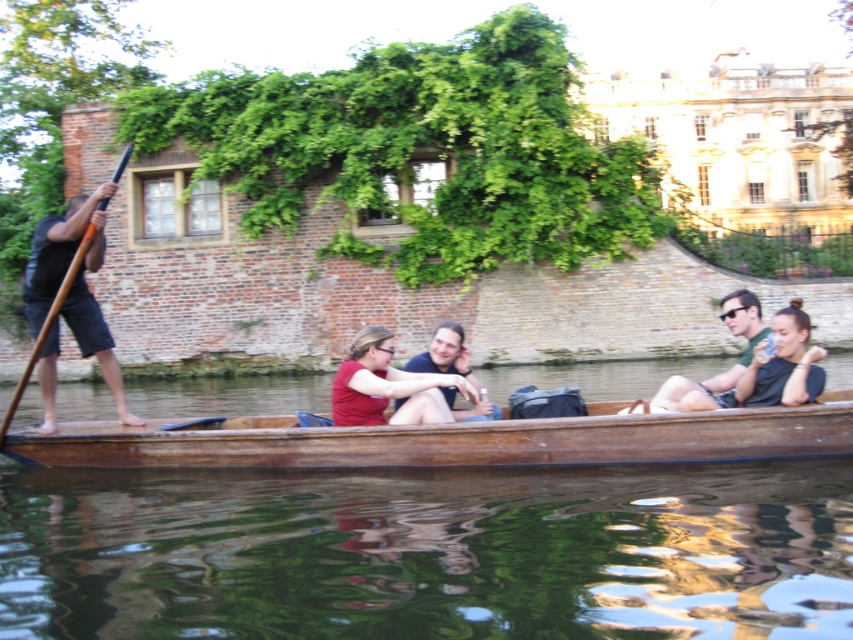
Can you confirm if wooden canoe at center is positioned to the left of matte red shirt at center?

Incorrect, wooden canoe at center is not on the left side of matte red shirt at center.

Which of these two, wooden canoe at center or matte red shirt at center, stands shorter?

matte red shirt at center

Does point (804, 440) come behind point (389, 365)?

No, it is in front of (389, 365).

Find the location of `wooden canoe at center`. wooden canoe at center is located at coordinates (451, 440).

Image resolution: width=853 pixels, height=640 pixels. What are the coordinates of `transparent water at boat bottom` in the screenshot? It's located at (430, 552).

Is transparent water at boat bottom in front of matte black shirt at center?

Yes.

Who is more forward, (306, 612) or (804, 328)?

Positioned in front is point (306, 612).

You are a GUI agent. You are given a task and a screenshot of the screen. Output one action in this format:
    pyautogui.click(x=<x>, y=<y>)
    Task: Click on the transparent water at boat bottom
    The image size is (853, 640).
    Given the screenshot: What is the action you would take?
    pyautogui.click(x=430, y=552)

Which is in front, point (796, 374) or point (757, 340)?

Point (796, 374) is more forward.

Identify the location of matte black shirt at center. The width and height of the screenshot is (853, 640). (782, 364).